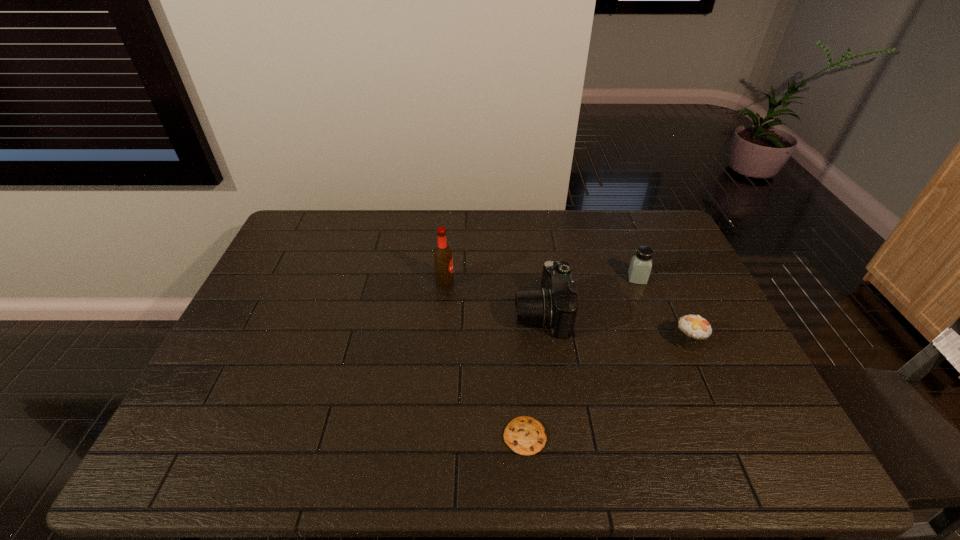
The height and width of the screenshot is (540, 960). I want to click on beer bottle, so click(x=443, y=261).

The height and width of the screenshot is (540, 960). In order to click on the tallest object in this screenshot , I will do `click(443, 261)`.

Identify the location of the fourth shortest object. (554, 306).

Find the location of a particular element. This screenshot has width=960, height=540. saltshaker is located at coordinates (639, 271).

Identify the location of cupcake. (692, 332).

Identify the location of cookie. (525, 435).

The width and height of the screenshot is (960, 540). I want to click on the shortest object, so click(525, 435).

You are a GUI agent. You are given a task and a screenshot of the screen. Output one action in this format:
    pyautogui.click(x=<x>, y=<y>)
    Task: Click on the free space located 0.100m on the right of the leftmost object
    Image resolution: width=960 pixels, height=540 pixels.
    Given the screenshot: What is the action you would take?
    pyautogui.click(x=485, y=282)

You are a GUI agent. You are given a task and a screenshot of the screen. Output one action in this format:
    pyautogui.click(x=<x>, y=<y>)
    Task: Click on the vacant area located 0.090m on the lens of the camera
    This screenshot has width=960, height=540.
    Given the screenshot: What is the action you would take?
    pyautogui.click(x=484, y=314)

At what (x,y) coordinates should I click in order to perform the action: click on free spot located on the lens of the camera. Please return your answer as a coordinate pair (x, y). The height and width of the screenshot is (540, 960). Looking at the image, I should click on (491, 314).